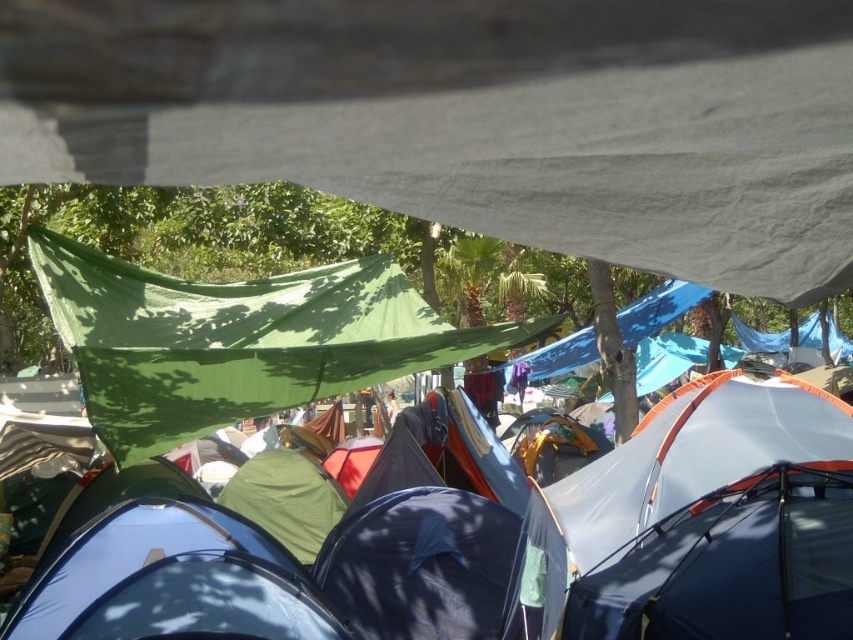
Question: Among these objects, which one is nearest to the camera?

Choices:
 (A) green fabric tent at center
 (B) green fabric canopy at upper left

Answer: (A)

Question: Where is green fabric tent at center located in relation to green fabric canopy at upper left in the image?

Choices:
 (A) left
 (B) right

Answer: (B)

Question: Does green fabric tent at center have a smaller size compared to green fabric canopy at upper left?

Choices:
 (A) no
 (B) yes

Answer: (B)

Question: Where is green fabric tent at center located in relation to green fabric canopy at upper left in the image?

Choices:
 (A) right
 (B) left

Answer: (A)

Question: Which of the following is the farthest from the observer?

Choices:
 (A) green fabric tent at center
 (B) green fabric canopy at upper left

Answer: (B)